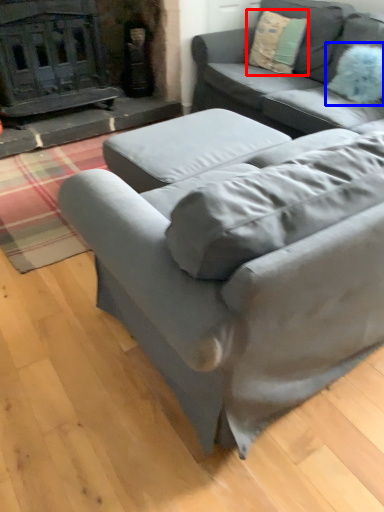
Question: Which point is further to the camera, throw pillow (highlighted by a red box) or pillow (highlighted by a blue box)?

Choices:
 (A) throw pillow
 (B) pillow

Answer: (A)